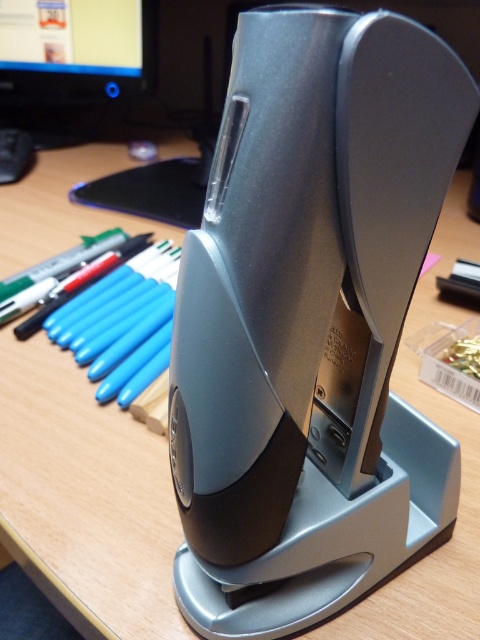
Is satin silver stapler at center bigger than matte black monitor at upper left?

No.

Looking at this image, is satin silver stapler at center to the left of matte black monitor at upper left from the viewer's perspective?

In fact, satin silver stapler at center is to the right of matte black monitor at upper left.

Is point (252, 438) farther from camera compared to point (8, 65)?

No, (252, 438) is in front of (8, 65).

Locate an element on the screen. satin silver stapler at center is located at coordinates (311, 321).

Is satin silver stapler at center smaller than black plastic mouse at upper left?

No.

Is satin silver stapler at center in front of black plastic mouse at upper left?

Yes, satin silver stapler at center is closer to the viewer.

Where is `satin silver stapler at center`? The height and width of the screenshot is (640, 480). satin silver stapler at center is located at coordinates (311, 321).

This screenshot has height=640, width=480. What are the coordinates of `satin silver stapler at center` in the screenshot? It's located at (311, 321).

Is matte black monitor at upper left to the left of black plastic mouse at upper left from the viewer's perspective?

In fact, matte black monitor at upper left is to the right of black plastic mouse at upper left.

Based on the photo, who is more forward, [39,132] or [29,150]?

Point [29,150] is more forward.

This screenshot has height=640, width=480. I want to click on matte black monitor at upper left, so click(x=72, y=61).